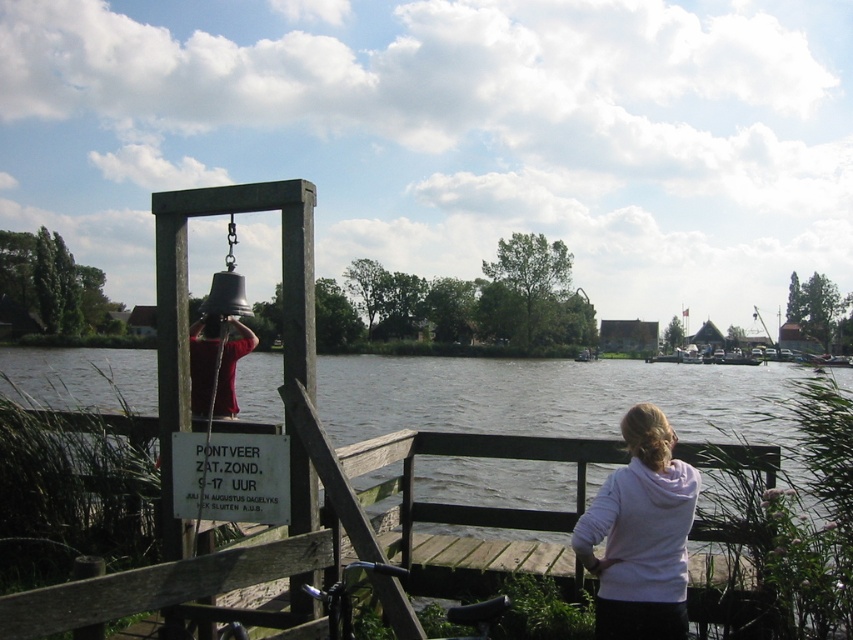
Question: Which object is positioned farthest from the dark gray plastic sign at lower center?

Choices:
 (A) wooden at center
 (B) white fleece jacket at lower right

Answer: (B)

Question: Which of the following is the farthest from the observer?

Choices:
 (A) (611, 524)
 (B) (492, 525)
 (C) (252, 477)

Answer: (B)

Question: Does white fleece jacket at lower right have a greater width compared to dark gray plastic sign at lower center?

Choices:
 (A) yes
 (B) no

Answer: (A)

Question: Is the position of wooden at center more distant than that of dark gray plastic sign at lower center?

Choices:
 (A) no
 (B) yes

Answer: (B)

Question: Does wooden at center appear on the left side of white fleece jacket at lower right?

Choices:
 (A) yes
 (B) no

Answer: (A)

Question: Which object is the closest to the dark gray plastic sign at lower center?

Choices:
 (A) wooden at center
 (B) white fleece jacket at lower right

Answer: (A)